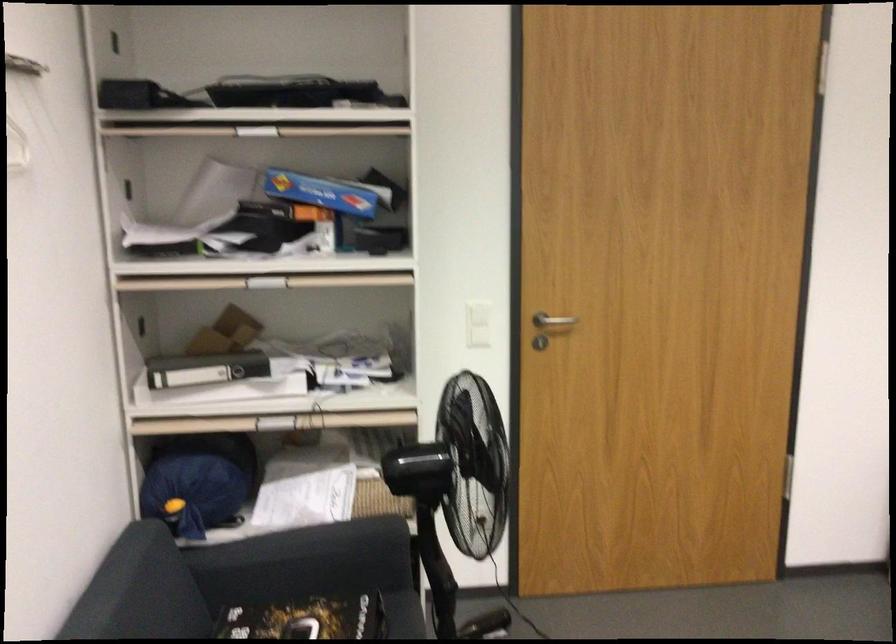
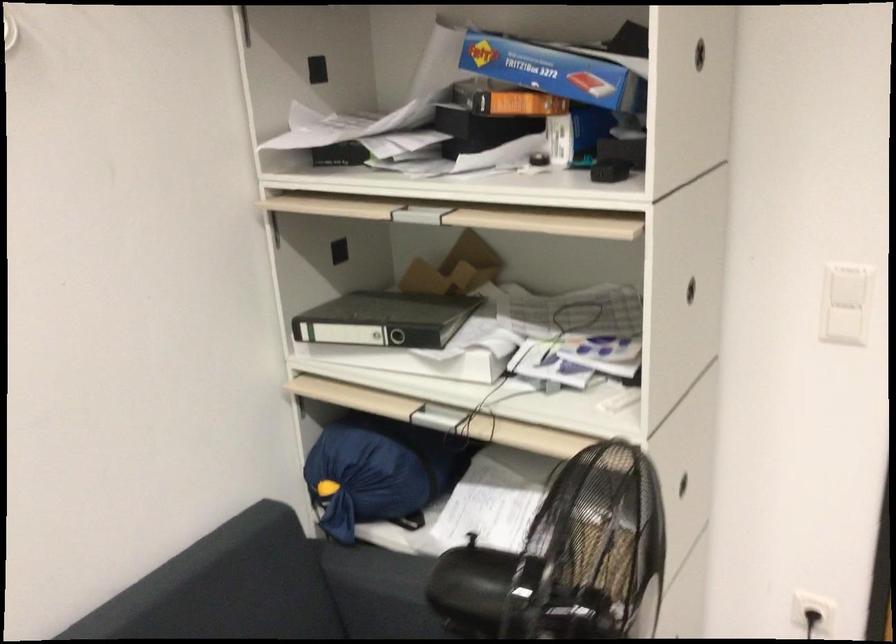
The point at (219, 486) is marked in the first image. Where is the corresponding point in the second image?

(376, 471)